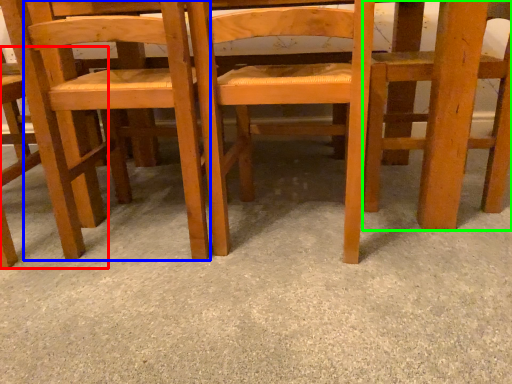
Question: Which object is positioned farthest from chair (highlighted by a red box)? Select from chair (highlighted by a blue box) and chair (highlighted by a green box).

Choices:
 (A) chair
 (B) chair

Answer: (B)